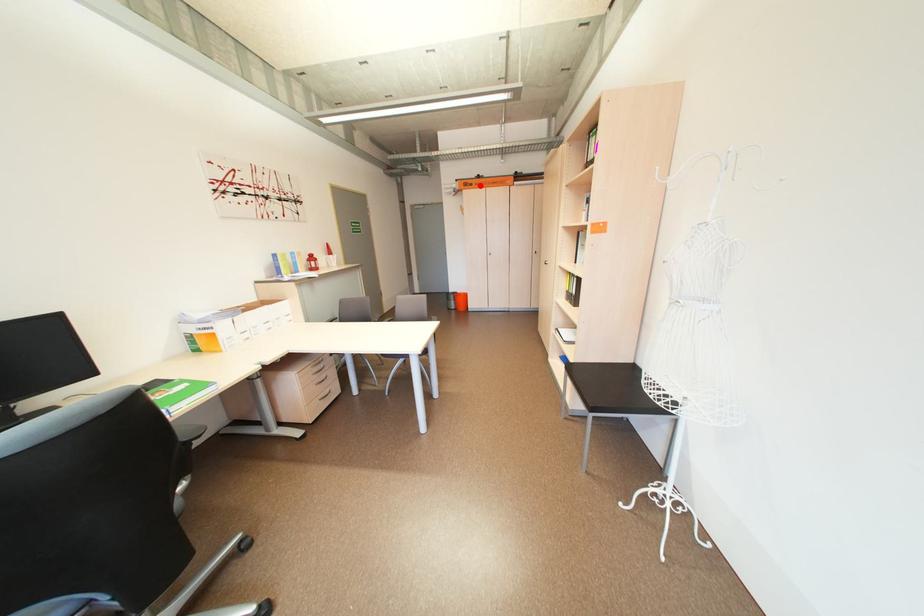
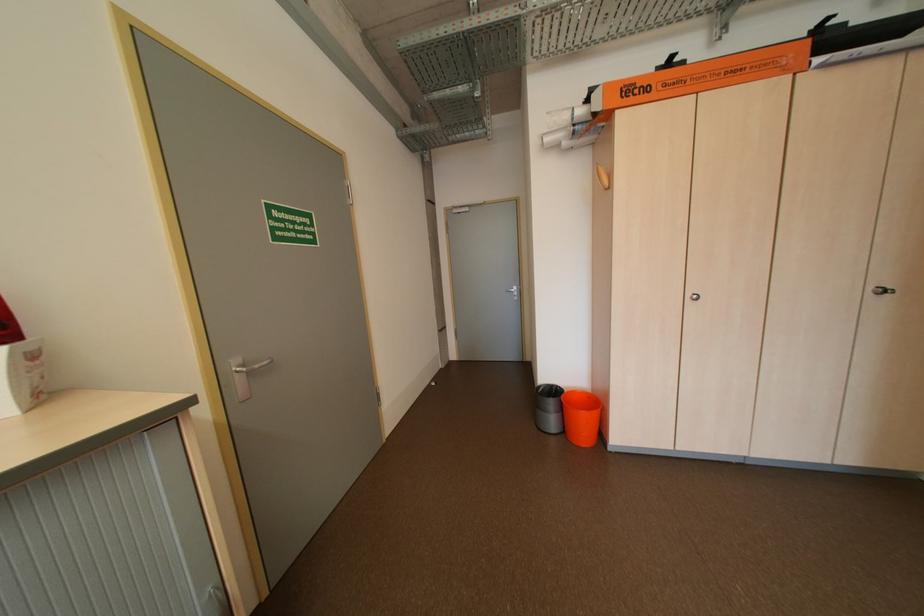
Question: I am providing you with two images of the same scene from different viewpoints. A red point is shown in image1. For the corresponding object point in image2, is it positioned nearer or farther from the camera?

Choices:
 (A) Nearer
 (B) Farther

Answer: (B)